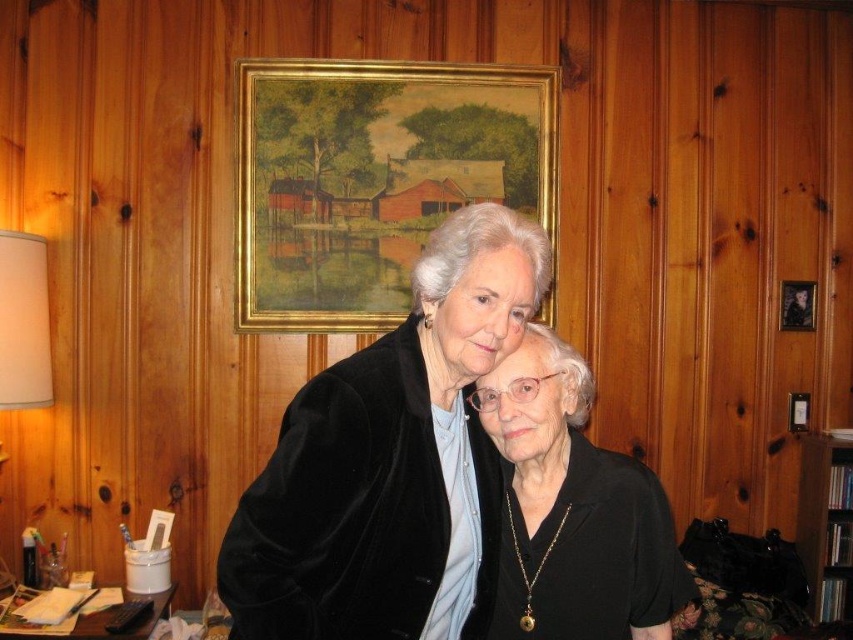
Question: From the image, what is the correct spatial relationship of velvet black jacket at center in relation to goldmaterial/texturepicture frame at upper center?

Choices:
 (A) above
 (B) below

Answer: (B)

Question: Is wooden bookshelf at right closer to camera compared to white fabric lampshade at left?

Choices:
 (A) yes
 (B) no

Answer: (B)

Question: Which point is closer to the camera?

Choices:
 (A) black velvet jacket at center
 (B) wooden picture frame at upper right
 (C) goldmaterial/texturepicture frame at upper center

Answer: (A)

Question: Can you confirm if goldmaterial/texturepicture frame at upper center is positioned to the right of wooden bookshelf at right?

Choices:
 (A) yes
 (B) no

Answer: (B)

Question: Among these objects, which one is farthest from the camera?

Choices:
 (A) wooden bookshelf at right
 (B) velvet black jacket at center
 (C) goldmaterial/texturepicture frame at upper center
 (D) wooden picture frame at upper right

Answer: (D)

Question: Which point appears closest to the camera in this image?

Choices:
 (A) (850, 547)
 (B) (608, 516)

Answer: (B)